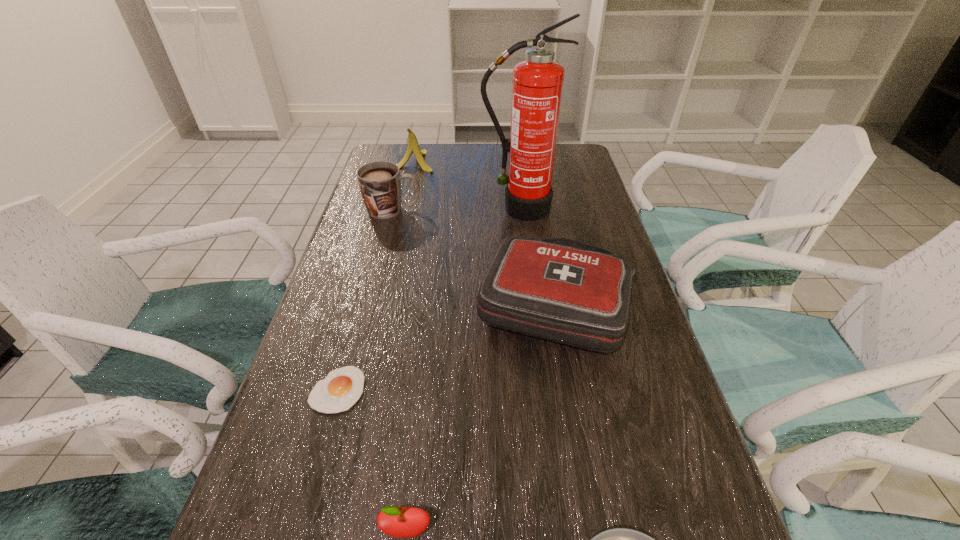
The width and height of the screenshot is (960, 540). In order to click on blank space at the right edge of the desktop in this screenshot , I will do `click(559, 205)`.

Where is `vacant region at the far right corner`? The height and width of the screenshot is (540, 960). vacant region at the far right corner is located at coordinates (571, 156).

Find the location of `free spot between the egg yolk and the banana`. free spot between the egg yolk and the banana is located at coordinates (375, 275).

In order to click on free space that is in between the fourth nearest object and the mug in this screenshot , I will do `click(475, 256)`.

Where is `vacant area that lies between the mug and the banana`? Image resolution: width=960 pixels, height=540 pixels. vacant area that lies between the mug and the banana is located at coordinates (403, 185).

At what (x,y) coordinates should I click in order to perform the action: click on vacant region between the fire extinguisher and the farthest object. Please return your answer as a coordinate pair (x, y). This screenshot has width=960, height=540. Looking at the image, I should click on (466, 185).

Locate an element on the screen. This screenshot has width=960, height=540. object that is the fourth closest one to the banana is located at coordinates (341, 389).

Choose which object is the nearest neighbor to the fourth object from right to left. Please provide its 2D coordinates. Your answer should be formatted as a tuple, i.e. [(x, y)], where the tuple contains the x and y coordinates of a point satisfying the conditions above.

[(619, 539)]

The height and width of the screenshot is (540, 960). In order to click on vacant area that satisfies the following two spatial constraints: 1. on the side of the fourth farthest object with the handle; 2. on the left side of the mug in this screenshot , I will do `click(369, 303)`.

Find the location of a particular element. The width and height of the screenshot is (960, 540). free point that satisfies the following two spatial constraints: 1. on the front-facing side of the tallest object; 2. on the side of the mug with the handle is located at coordinates (519, 210).